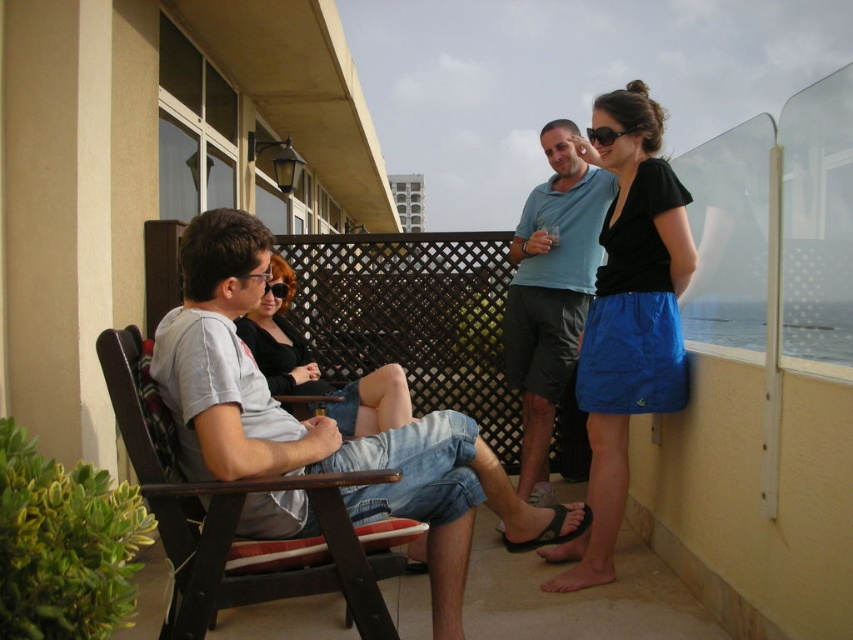
Between matte blue skirt at right and blue cotton shirt at upper right, which one is positioned higher?

blue cotton shirt at upper right

Can you confirm if matte blue skirt at right is smaller than blue cotton shirt at upper right?

No.

This screenshot has width=853, height=640. I want to click on matte blue skirt at right, so click(627, 317).

Locate an element on the screen. matte blue skirt at right is located at coordinates (627, 317).

Can you confirm if wooden chair at center is bigger than matte black sunglasses at center?

Incorrect, wooden chair at center is not larger than matte black sunglasses at center.

Does wooden chair at center appear over matte black sunglasses at center?

No, wooden chair at center is not above matte black sunglasses at center.

Does point (195, 500) come closer to viewer compared to point (373, 406)?

Yes, point (195, 500) is in front of point (373, 406).

Where is `wooden chair at center`? Image resolution: width=853 pixels, height=640 pixels. wooden chair at center is located at coordinates (236, 524).

Describe the element at coordinates (323, 422) in the screenshot. I see `matte gray shirt at center` at that location.

Which is more to the right, matte gray shirt at center or matte black sunglasses at center?

matte gray shirt at center is more to the right.

Between point (310, 525) and point (368, 424), which one is positioned behind?

The point (368, 424) is behind.

At what (x,y) coordinates should I click in order to perform the action: click on matte gray shirt at center. Please return your answer as a coordinate pair (x, y). This screenshot has height=640, width=853. Looking at the image, I should click on (323, 422).